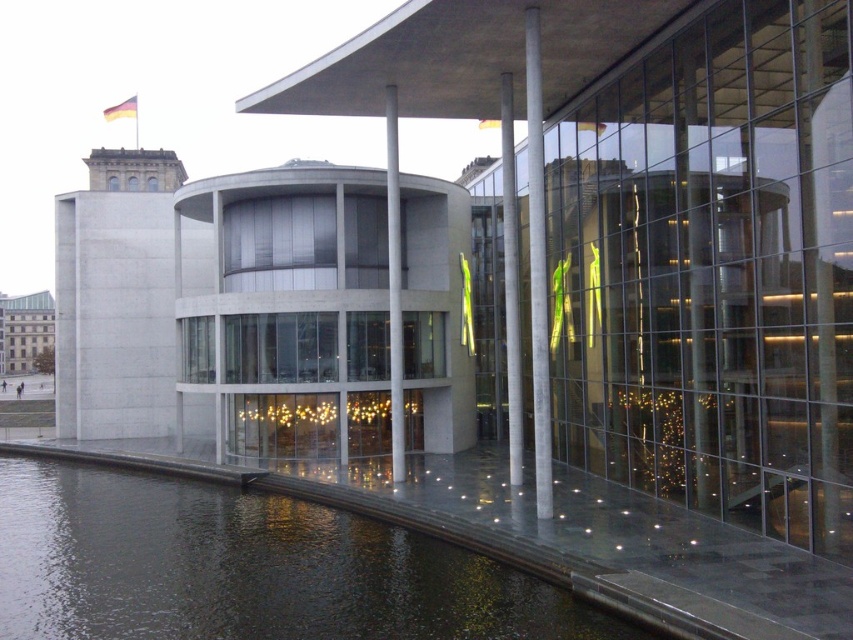
Question: Among these objects, which one is nearest to the camera?

Choices:
 (A) sleek metallic pole at center
 (B) transparent glass waterway at lower left
 (C) concrete pillar at center

Answer: (B)

Question: From the image, what is the correct spatial relationship of transparent glass waterway at lower left in relation to concrete pillar at center?

Choices:
 (A) above
 (B) below

Answer: (B)

Question: Estimate the real-world distances between objects in this image. Which object is closer to the sleek metallic pole at center?

Choices:
 (A) transparent glass waterway at lower left
 (B) white concrete pillar at center

Answer: (B)

Question: Is transparent glass waterway at lower left smaller than sleek metallic pole at center?

Choices:
 (A) no
 (B) yes

Answer: (A)

Question: Can you confirm if transparent glass waterway at lower left is positioned to the right of white concrete pillar at center?

Choices:
 (A) yes
 (B) no

Answer: (B)

Question: Which point is closer to the camera?

Choices:
 (A) (544, 332)
 (B) (115, 604)
 (C) (509, 417)
 (D) (393, 474)

Answer: (B)